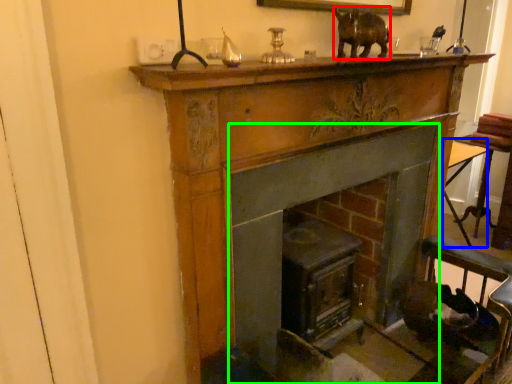
Question: Based on their relative distances, which object is farther from animal (highlighted by a red box)? Choose from table (highlighted by a blue box) and fireplace (highlighted by a green box).

Choices:
 (A) table
 (B) fireplace

Answer: (A)